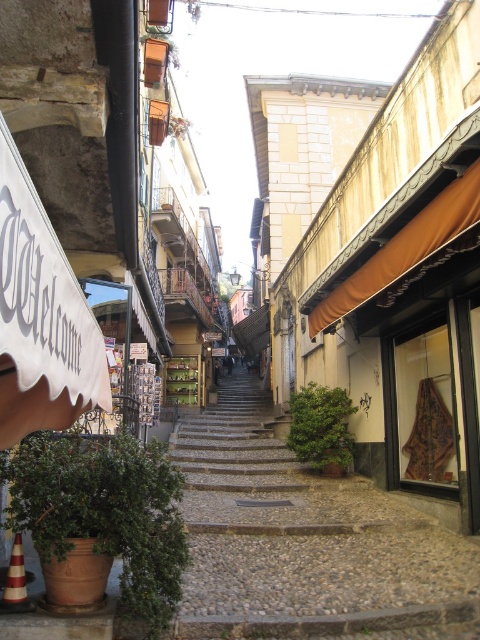
Is smooth stone stairs at center above orange traffic cone at lower left?

Incorrect, smooth stone stairs at center is not positioned above orange traffic cone at lower left.

Find the location of a particular element. smooth stone stairs at center is located at coordinates (302, 538).

Find the location of a particular element. smooth stone stairs at center is located at coordinates (302, 538).

This screenshot has height=640, width=480. Identify the location of smooth stone stairs at center. (302, 538).